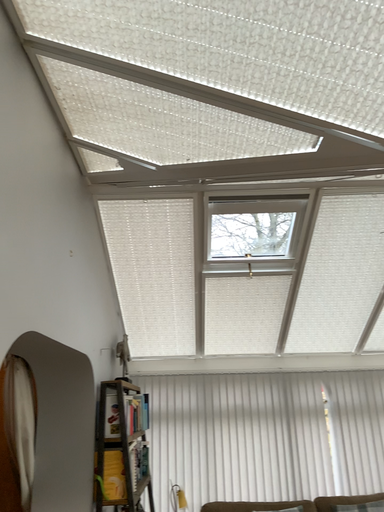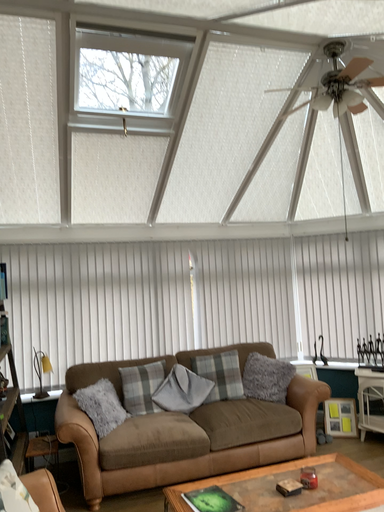
Question: Which way did the camera rotate in the video?

Choices:
 (A) rotated right
 (B) rotated left

Answer: (A)